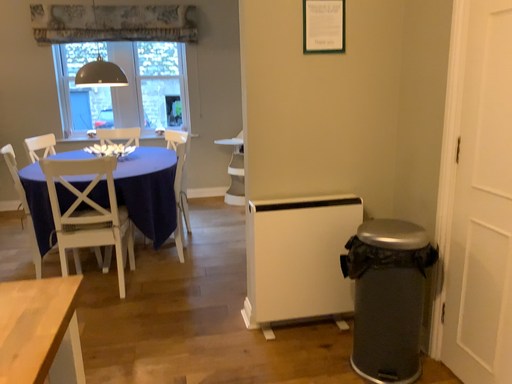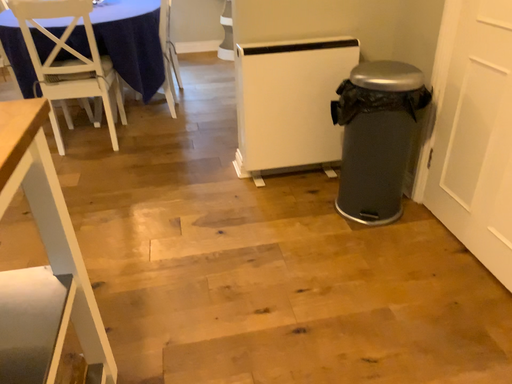
Question: How did the camera likely rotate when shooting the video?

Choices:
 (A) rotated upward
 (B) rotated downward

Answer: (B)